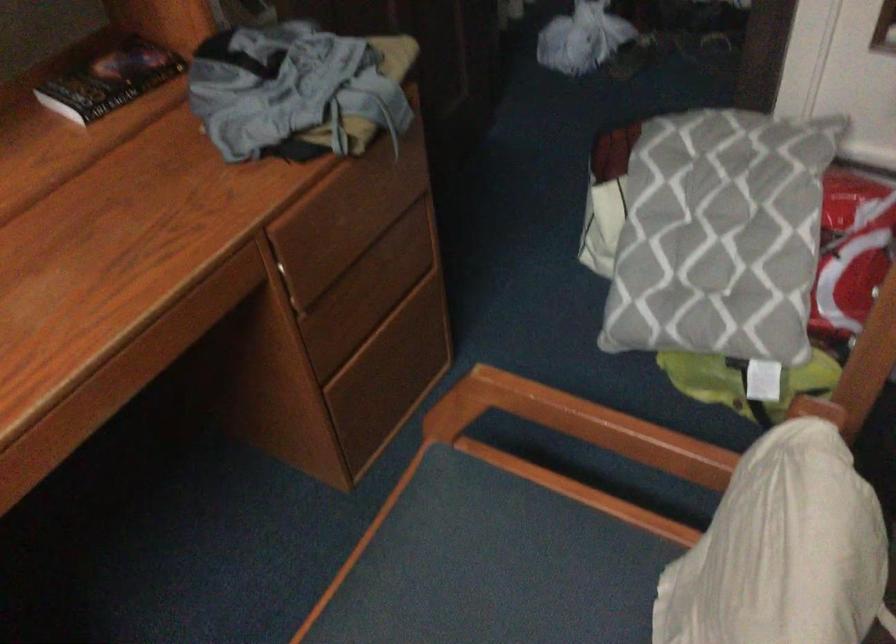
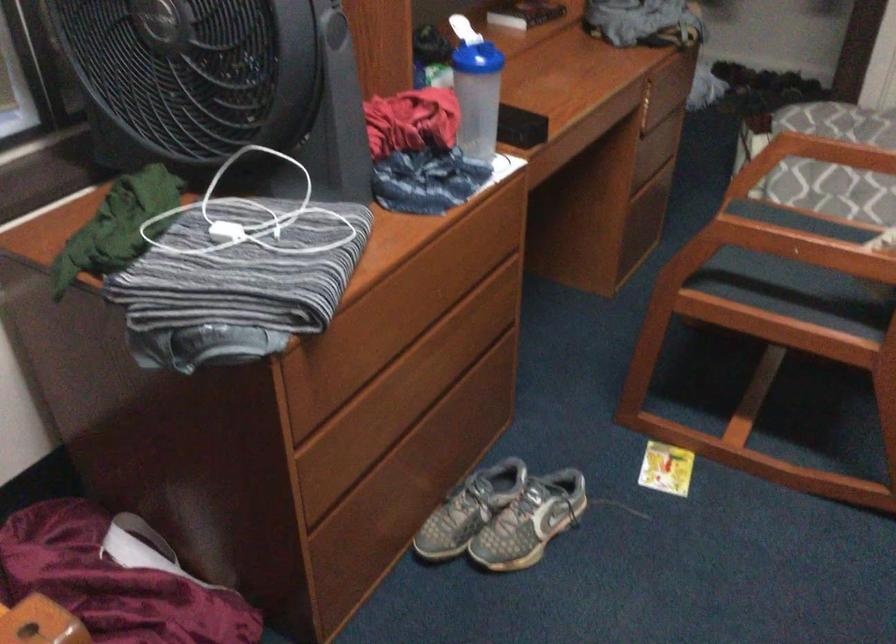
Question: I am providing you with two images of the same scene from different viewpoints. After the viewpoint changes to image2, which objects are now occluded?

Choices:
 (A) blue-lidded bottle
 (B) document feeder tray
 (C) chair sitting surface
 (D) chair armrest

Answer: (C)